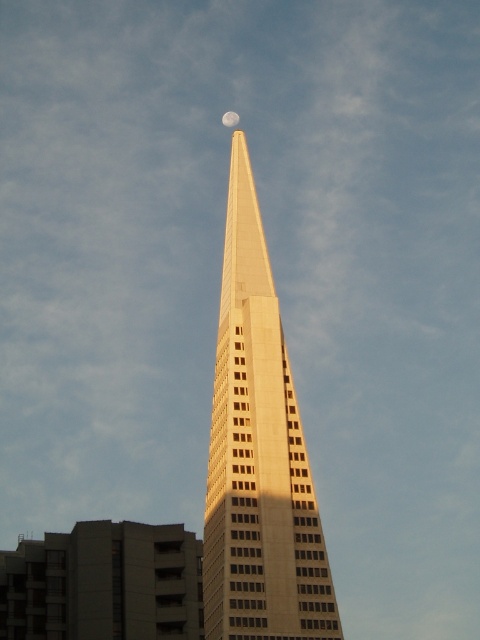
Question: Which of the following is the closest to the observer?

Choices:
 (A) silvery reflective moon at upper center
 (B) beige concrete skyscraper at center

Answer: (B)

Question: Is beige concrete skyscraper at center closer to the viewer compared to silvery reflective moon at upper center?

Choices:
 (A) yes
 (B) no

Answer: (A)

Question: Is beige concrete skyscraper at center below silvery reflective moon at upper center?

Choices:
 (A) no
 (B) yes

Answer: (B)

Question: From the image, what is the correct spatial relationship of beige concrete skyscraper at center in relation to silvery reflective moon at upper center?

Choices:
 (A) left
 (B) right

Answer: (B)

Question: Which of the following is the farthest from the observer?

Choices:
 (A) beige concrete skyscraper at center
 (B) silvery reflective moon at upper center

Answer: (B)